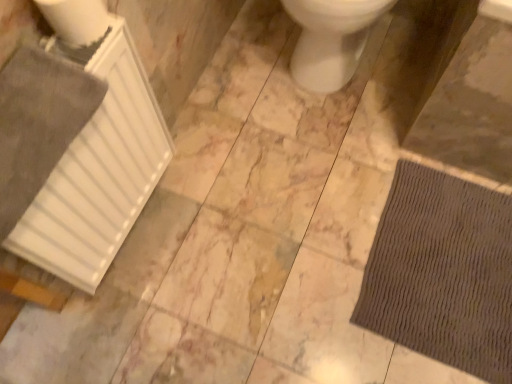
Question: Is white glossy toilet at center further to camera compared to brown textured mat at lower right?

Choices:
 (A) no
 (B) yes

Answer: (A)

Question: Does white glossy toilet at center have a greater width compared to brown textured mat at lower right?

Choices:
 (A) yes
 (B) no

Answer: (A)

Question: Is white glossy toilet at center facing away from brown textured mat at lower right?

Choices:
 (A) yes
 (B) no

Answer: (B)

Question: Considering the relative sizes of white glossy toilet at center and brown textured mat at lower right in the image provided, is white glossy toilet at center smaller than brown textured mat at lower right?

Choices:
 (A) yes
 (B) no

Answer: (B)

Question: Does white glossy toilet at center have a lesser height compared to brown textured mat at lower right?

Choices:
 (A) yes
 (B) no

Answer: (B)

Question: Is white glossy toilet at center taller than brown textured mat at lower right?

Choices:
 (A) no
 (B) yes

Answer: (B)

Question: Can you confirm if white matte radiator at left is shorter than white glossy toilet at center?

Choices:
 (A) yes
 (B) no

Answer: (B)

Question: Considering the relative positions of white matte radiator at left and white glossy toilet at center in the image provided, is white matte radiator at left in front of white glossy toilet at center?

Choices:
 (A) no
 (B) yes

Answer: (B)

Question: From a real-world perspective, is white matte radiator at left over white glossy toilet at center?

Choices:
 (A) yes
 (B) no

Answer: (A)

Question: Is the surface of white matte radiator at left in direct contact with white glossy toilet at center?

Choices:
 (A) no
 (B) yes

Answer: (A)

Question: From the image's perspective, is white matte radiator at left under white glossy toilet at center?

Choices:
 (A) no
 (B) yes

Answer: (B)

Question: Are white matte radiator at left and white glossy toilet at center far apart?

Choices:
 (A) yes
 (B) no

Answer: (B)

Question: Considering the relative sizes of white matte radiator at left and brown textured mat at lower right in the image provided, is white matte radiator at left smaller than brown textured mat at lower right?

Choices:
 (A) no
 (B) yes

Answer: (A)